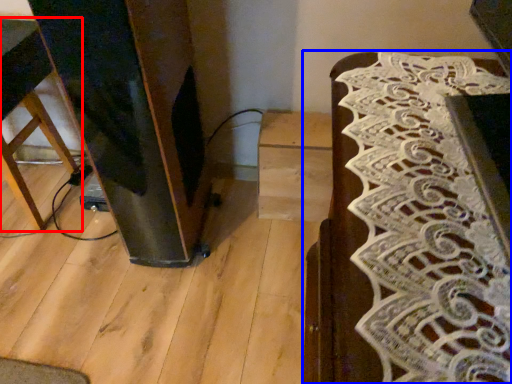
Question: Which object is closer to the camera taking this photo, furniture (highlighted by a red box) or furniture (highlighted by a blue box)?

Choices:
 (A) furniture
 (B) furniture

Answer: (B)